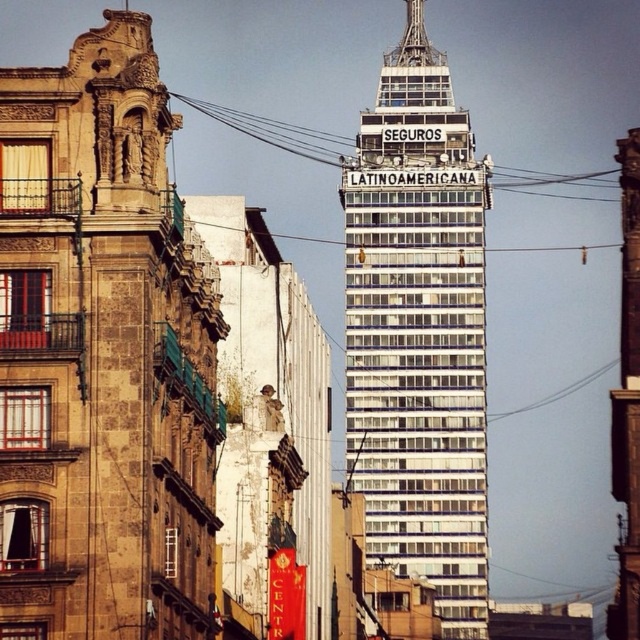
Which is below, brown stone building at left or white glass building at center?

brown stone building at left is below.

Does brown stone building at left have a greater width compared to white glass building at center?

No.

Which is in front, point (13, 611) or point (490, 168)?

Positioned in front is point (13, 611).

Where is `brown stone building at left`? brown stone building at left is located at coordinates (102, 355).